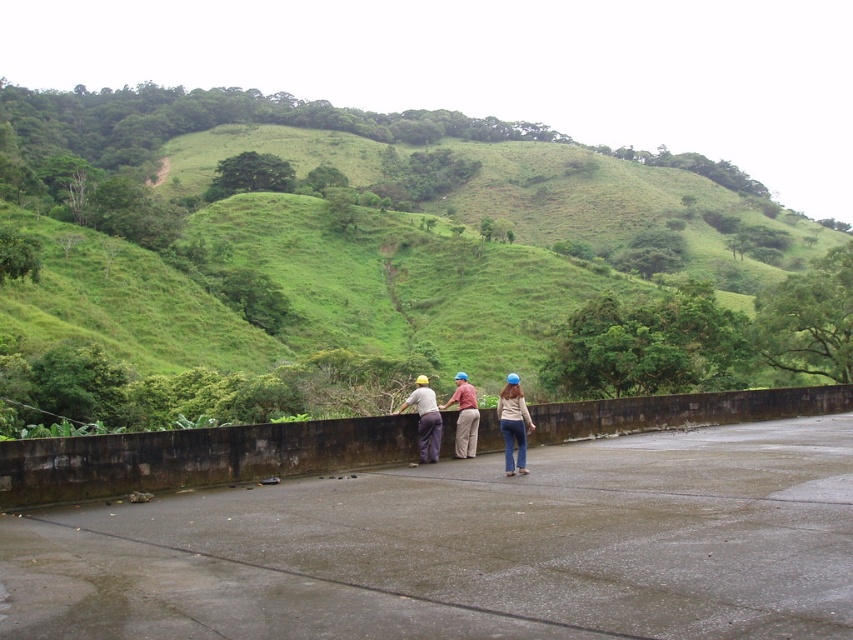
Question: Which of the following is the farthest from the observer?

Choices:
 (A) (457, 390)
 (B) (514, 380)
 (C) (428, 458)
 (D) (209, 104)

Answer: (D)

Question: Considering the relative positions of green grassy hillside at upper center and denim jacket at center in the image provided, where is green grassy hillside at upper center located with respect to denim jacket at center?

Choices:
 (A) above
 (B) below

Answer: (A)

Question: Which point is farther to the camera?

Choices:
 (A) (474, 440)
 (B) (412, 394)

Answer: (A)

Question: Does denim jacket at center appear on the left side of matte brown shirt at center?

Choices:
 (A) yes
 (B) no

Answer: (B)

Question: Can you confirm if green grassy hillside at upper center is positioned to the right of matte gray shirt at center?

Choices:
 (A) yes
 (B) no

Answer: (B)

Question: Which point is closer to the camera?

Choices:
 (A) (523, 444)
 (B) (416, 387)

Answer: (A)